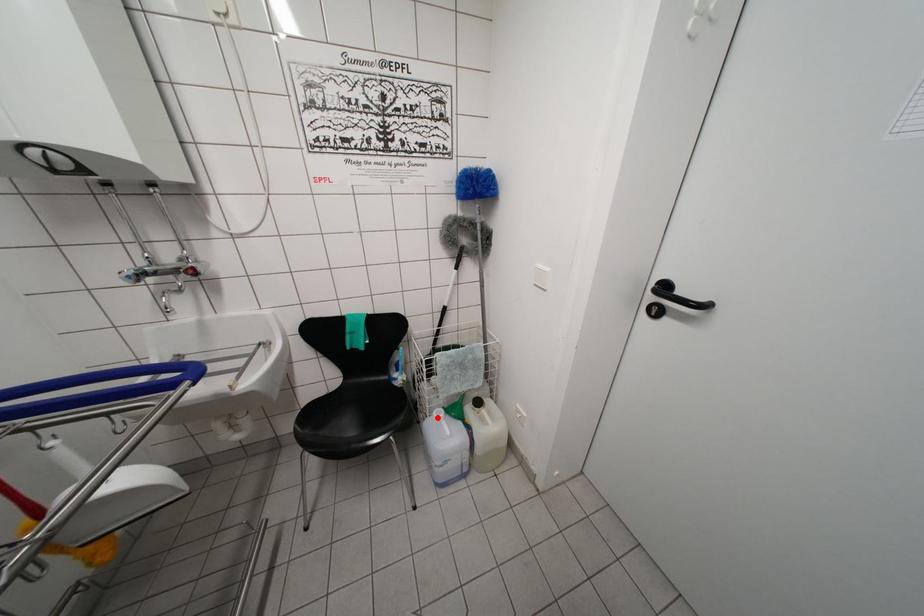
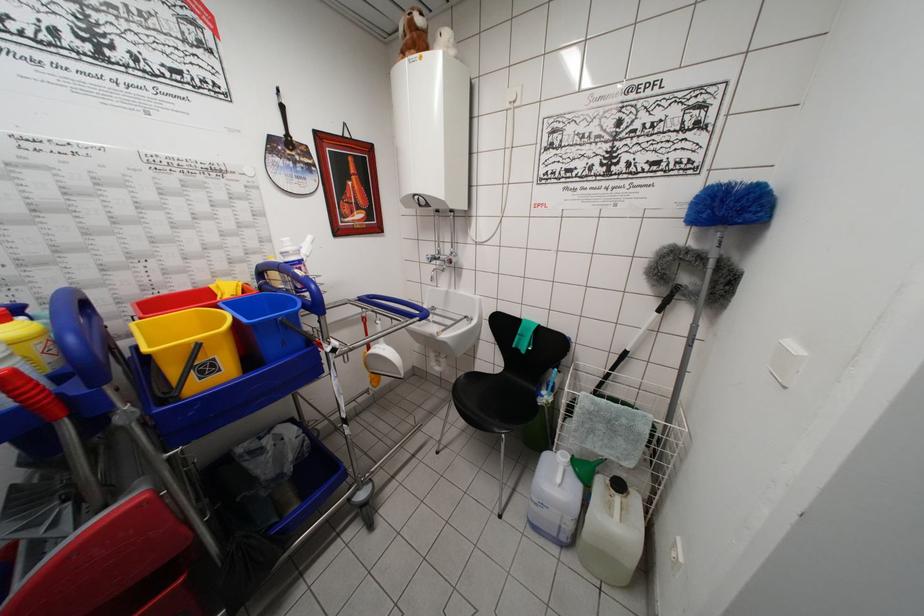
Question: I am providing you with two images of the same scene from different viewpoints. A red point is shown in image1. For the corresponding object point in image2, is it positioned nearer or farther from the camera?

Choices:
 (A) Nearer
 (B) Farther

Answer: (A)